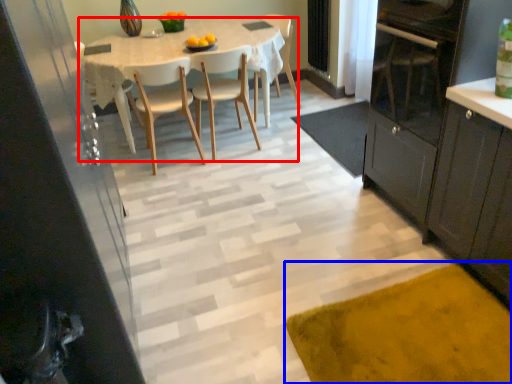
Question: Which object appears farthest to the camera in this image, kitchen & dining room table (highlighted by a red box) or doormat (highlighted by a blue box)?

Choices:
 (A) kitchen & dining room table
 (B) doormat

Answer: (A)